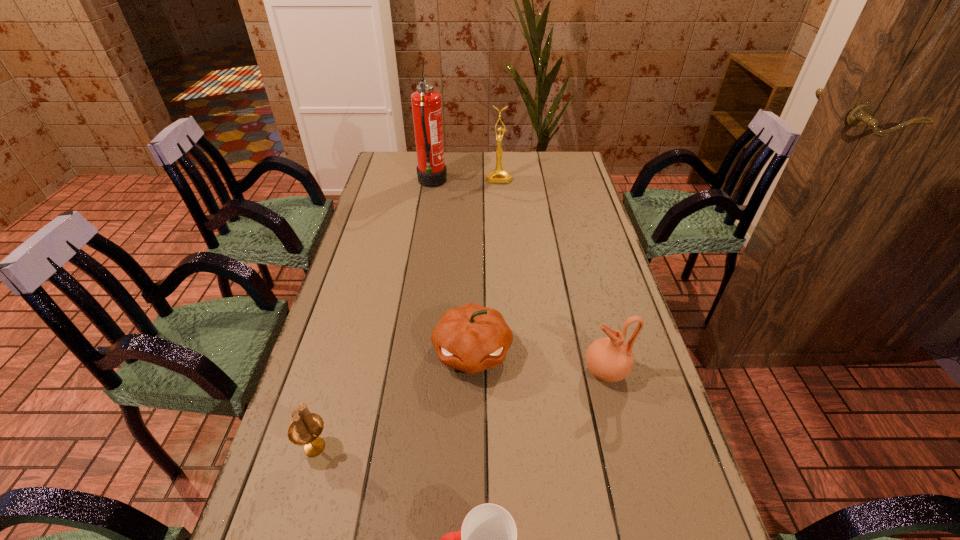
This screenshot has height=540, width=960. I want to click on free region located 0.200m on the spout of the pottery, so click(503, 371).

Where is `free space located 0.330m on the spout of the pottery`? This screenshot has height=540, width=960. free space located 0.330m on the spout of the pottery is located at coordinates (450, 371).

The image size is (960, 540). I want to click on vacant point located on the back of the candle holder, so click(351, 321).

Locate an element on the screen. The height and width of the screenshot is (540, 960). free space located 0.120m on the front face of the pumpkin is located at coordinates (471, 433).

You are a GUI agent. You are given a task and a screenshot of the screen. Output one action in this format:
    pyautogui.click(x=<x>, y=<y>)
    Task: Click on the fire extinguisher that is positioned at the far edge
    The width and height of the screenshot is (960, 540).
    Given the screenshot: What is the action you would take?
    pyautogui.click(x=426, y=103)

This screenshot has height=540, width=960. Find the location of `award that is at the far edge`. award that is at the far edge is located at coordinates (498, 175).

Where is `object at the left edge`? This screenshot has width=960, height=540. object at the left edge is located at coordinates (305, 429).

The image size is (960, 540). What are the coordinates of `object at the right edge` in the screenshot? It's located at (609, 359).

In the image, there is a desktop. At what (x,y) coordinates should I click in order to perform the action: click on free space at the left edge. Please return your answer as a coordinate pair (x, y). The image size is (960, 540). Looking at the image, I should click on (353, 259).

Where is `blank area at the right edge`? This screenshot has height=540, width=960. blank area at the right edge is located at coordinates (575, 184).